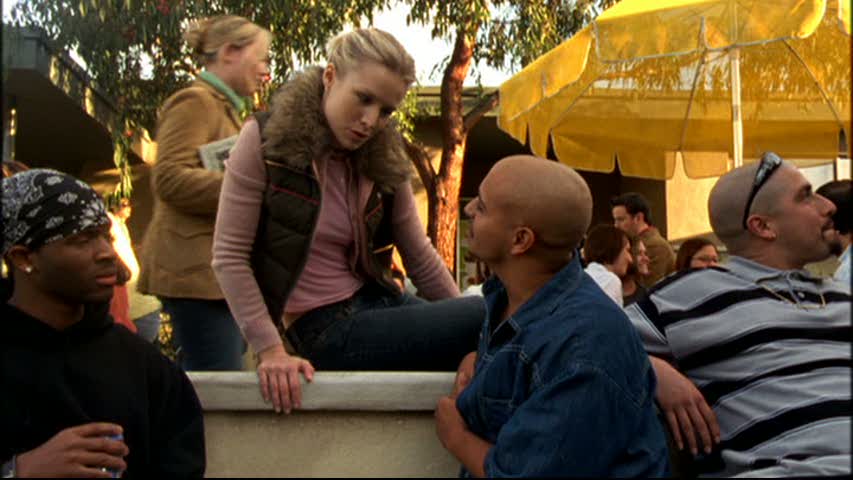
This screenshot has height=480, width=853. In order to click on glass in this screenshot , I will do `click(768, 170)`.